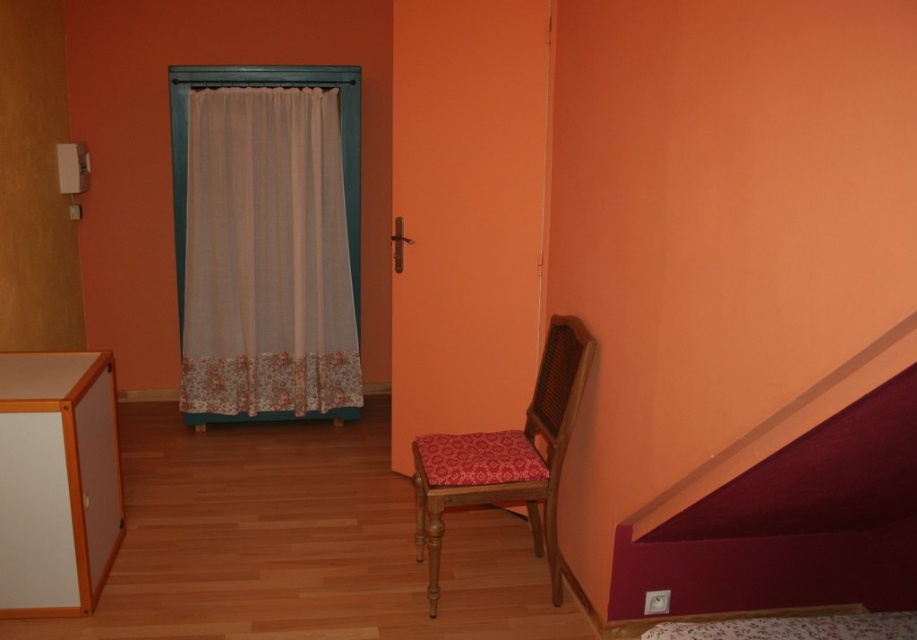
You are moving a 1.2 meter wide painting and need to place it against the wall. The painting is too heavy to lift, so you can only slide it horizontally. You have two options for placement near the wall in this room. One spot is next to the maroon fabric stair at lower right, and the other is next to the orange wood cabinet at lower left. Based on their widths, which location will allow the painting to fit better without overlapping either object?

The maroon fabric stair at lower right has a greater width than the orange wood cabinet at lower left. Since the painting is 1.2 meters wide, placing it next to the maroon fabric stair at lower right provides more space, allowing the painting to fit better without overlapping.

You are moving a 5.5 feet wide sofa into the room. The sofa needs to fit through the space between the orange wood cabinet at lower left and the floral fabric bed at lower right. Can the sofa fit through that space?

The distance between the orange wood cabinet at lower left and the floral fabric bed at lower right is 6.37 feet. Since the sofa is 5.5 feet wide, it can fit through the space as the distance is wider than the sofa.